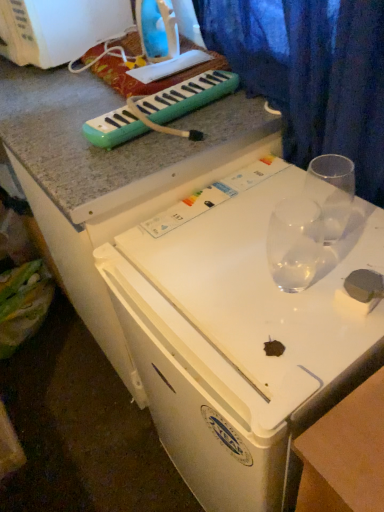
Identify the location of unoccupied region to the right of transparent glass at upper right, which is the first martini glass in right-to-left order. [363, 222].